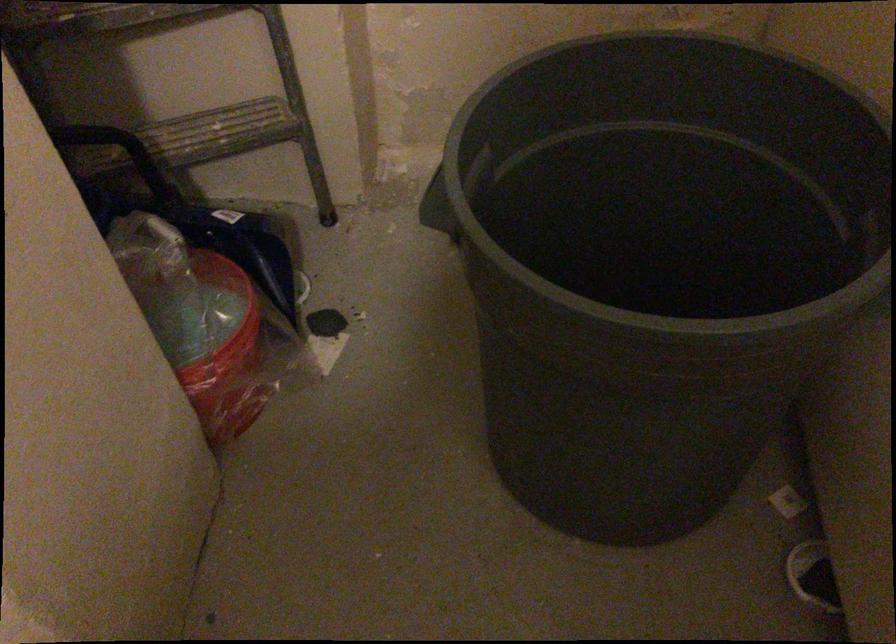
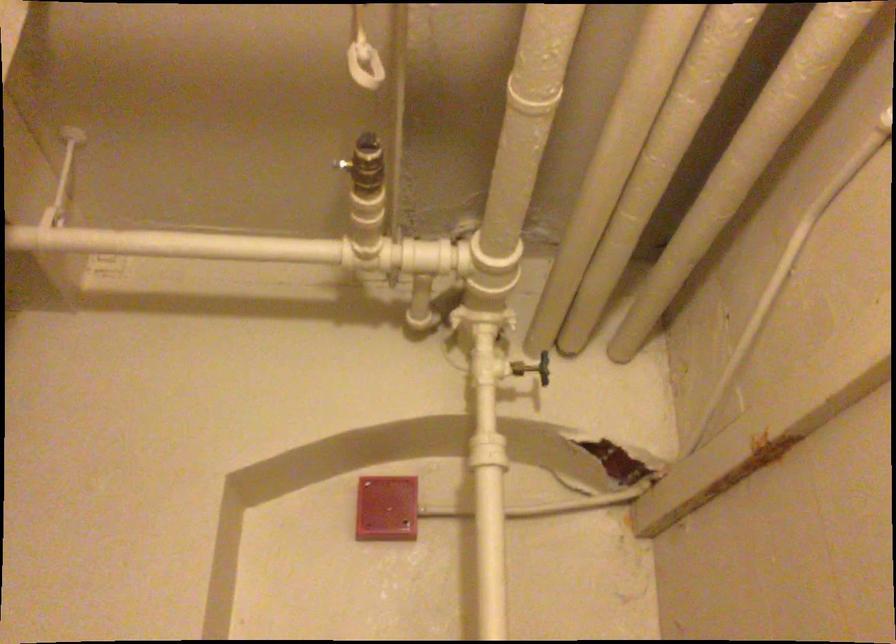
First-person continuous shooting, in which direction is the camera rotating?

The rotation direction of the camera is right-up.